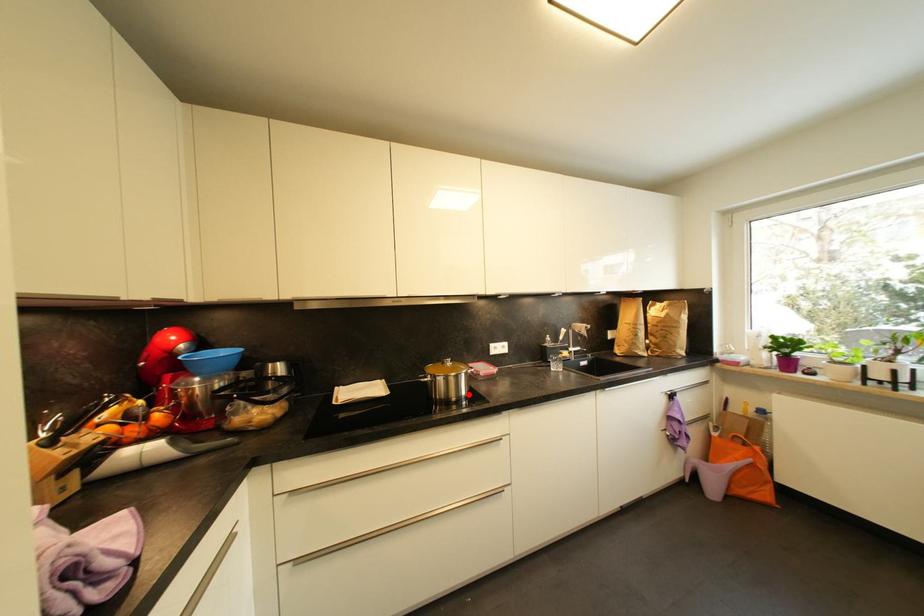
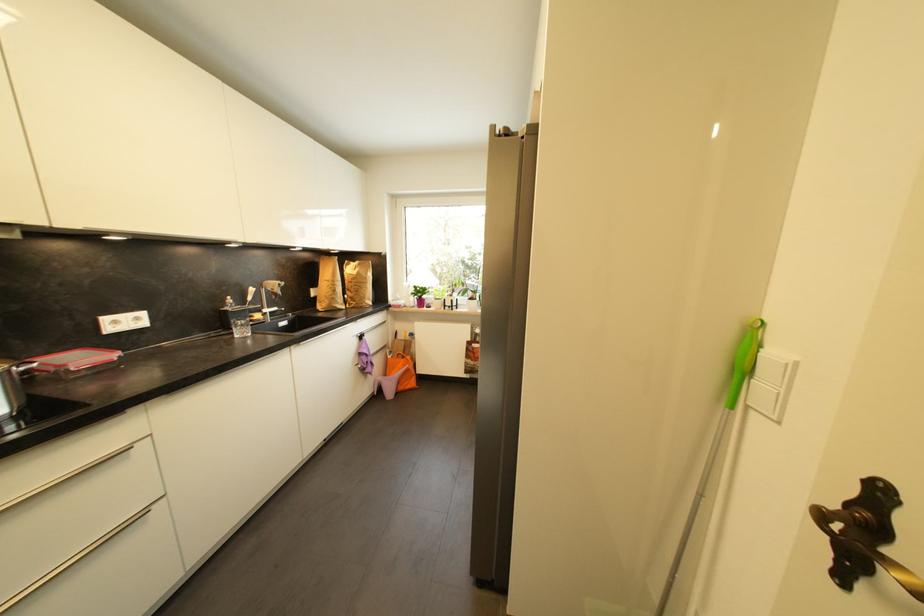
Question: I am providing you with two images of the same scene from different viewpoints. A red point is marked on the first image. At the location where the point appears in image 1, is it still visible in image 2?

Choices:
 (A) Yes
 (B) No

Answer: (A)